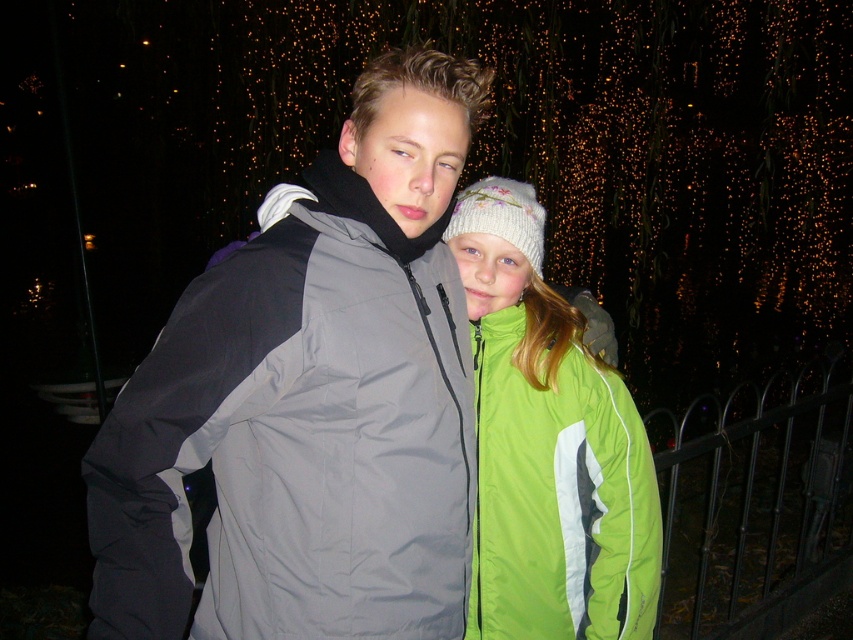
Can you confirm if green fabric jacket at center is positioned above black wrought iron fence at lower right?

Yes.

Which is more to the right, green fabric jacket at center or black wrought iron fence at lower right?

Positioned to the right is black wrought iron fence at lower right.

Which is in front, point (601, 545) or point (747, 540)?

Positioned in front is point (601, 545).

This screenshot has height=640, width=853. Identify the location of green fabric jacket at center. (548, 445).

Does gray synthetic jacket at center have a smaller size compared to black wrought iron fence at lower right?

Indeed, gray synthetic jacket at center has a smaller size compared to black wrought iron fence at lower right.

You are a GUI agent. You are given a task and a screenshot of the screen. Output one action in this format:
    pyautogui.click(x=<x>, y=<y>)
    Task: Click on the gray synthetic jacket at center
    Image resolution: width=853 pixels, height=640 pixels.
    Given the screenshot: What is the action you would take?
    pyautogui.click(x=297, y=438)

This screenshot has width=853, height=640. Identify the location of gray synthetic jacket at center. (297, 438).

Can you confirm if gray synthetic jacket at center is positioned to the left of green fabric jacket at center?

Indeed, gray synthetic jacket at center is positioned on the left side of green fabric jacket at center.

Is point (389, 406) positioned after point (492, 177)?

No, (389, 406) is closer to viewer.

You are a GUI agent. You are given a task and a screenshot of the screen. Output one action in this format:
    pyautogui.click(x=<x>, y=<y>)
    Task: Click on the gray synthetic jacket at center
    This screenshot has width=853, height=640.
    Given the screenshot: What is the action you would take?
    click(x=297, y=438)